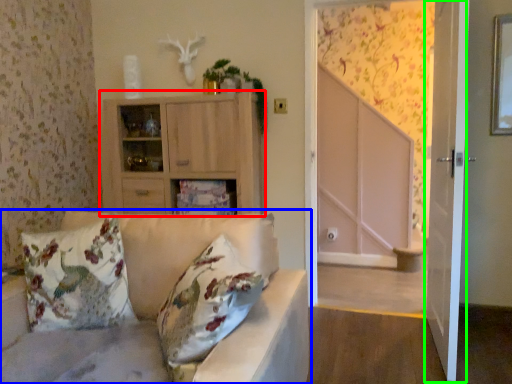
Question: Based on their relative distances, which object is farther from cabinetry (highlighted by a red box)? Choose from studio couch (highlighted by a blue box) and screen door (highlighted by a green box).

Choices:
 (A) studio couch
 (B) screen door

Answer: (B)